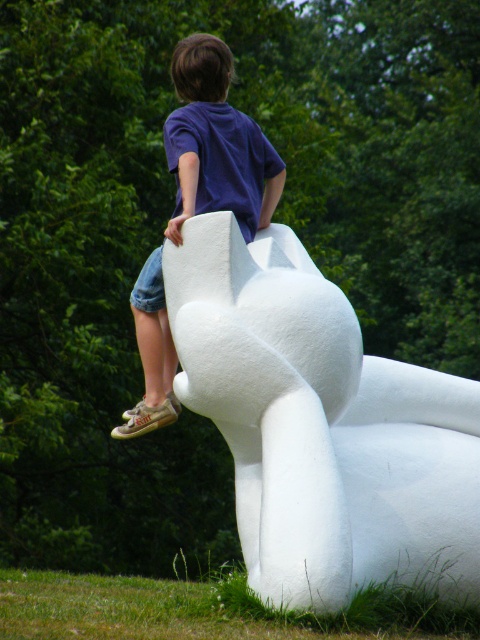
Which of these two, white matte sculpture at upper center or matte blue shirt at upper center, stands shorter?

matte blue shirt at upper center

Between white matte sculpture at upper center and matte blue shirt at upper center, which one appears on the left side from the viewer's perspective?

matte blue shirt at upper center is more to the left.

Where is `white matte sculpture at upper center`? white matte sculpture at upper center is located at coordinates pyautogui.click(x=322, y=426).